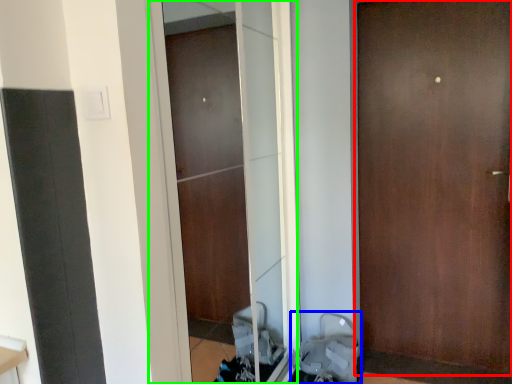
Question: Which object is positioned farthest from door (highlighted by a red box)? Select from baby carriage (highlighted by a blue box) and screen door (highlighted by a green box).

Choices:
 (A) baby carriage
 (B) screen door

Answer: (A)